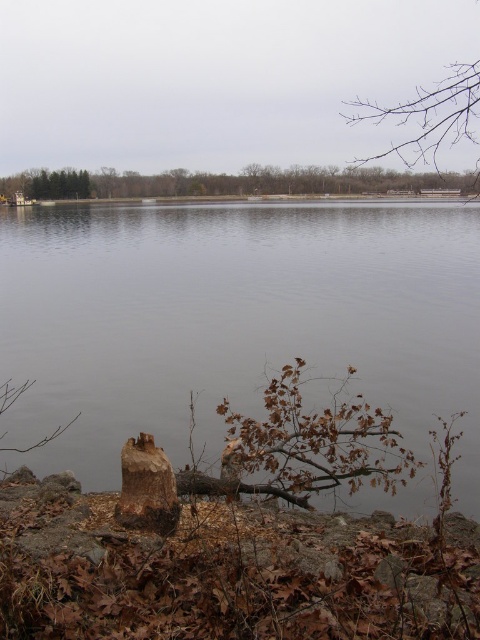
You are standing at the edge of the lake and want to cross to the other side. The gray water at center is the path you need to take. Considering the brown rough tree trunk at lower center is in your way, can you walk around it to reach the water?

The brown rough tree trunk at lower center is at lower center, so you can walk around it to reach the gray water at center which is at the center of the lake. The trunk is not blocking the path to the water directly since it is positioned lower center, so yes, you can navigate around it to get to the water.

You are standing at the lakeside and want to take a photo of both the point at coordinates point (335, 168) and point (359, 122). Which point will appear larger in your photo?

Point (335, 168) will appear larger in the photo because it is closer to the camera than point (359, 122).

You are standing at the center of the image and want to walk towards the brown wood tree at center. In which direction should you move?

Since the brown wood tree at center is already at the center of the image, you are already facing it. No need to move in any direction.